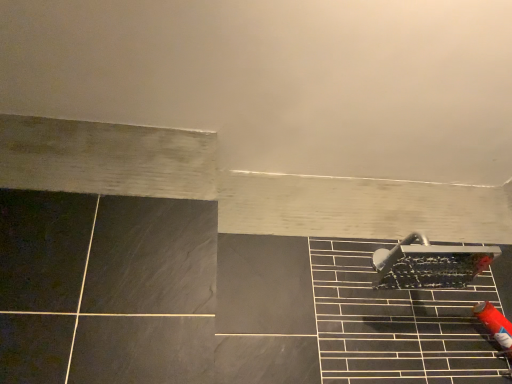
Question: From the image's perspective, is matte black tile at lower right above or below satin nickel showerhead at lower right?

Choices:
 (A) below
 (B) above

Answer: (A)

Question: Considering the positions of matte black tile at lower right and satin nickel showerhead at lower right in the image, is matte black tile at lower right wider or thinner than satin nickel showerhead at lower right?

Choices:
 (A) wide
 (B) thin

Answer: (A)

Question: Looking at the image, does matte black tile at lower right seem bigger or smaller compared to satin nickel showerhead at lower right?

Choices:
 (A) small
 (B) big

Answer: (B)

Question: Based on their positions, is satin nickel showerhead at lower right located to the left or right of matte black tile at lower right?

Choices:
 (A) left
 (B) right

Answer: (B)

Question: Is point (392, 249) positioned closer to the camera than point (377, 327)?

Choices:
 (A) farther
 (B) closer

Answer: (A)

Question: Considering the positions of satin nickel showerhead at lower right and matte black tile at lower right in the image, is satin nickel showerhead at lower right wider or thinner than matte black tile at lower right?

Choices:
 (A) wide
 (B) thin

Answer: (B)

Question: Is satin nickel showerhead at lower right in front of or behind matte black tile at lower right in the image?

Choices:
 (A) front
 (B) behind

Answer: (B)